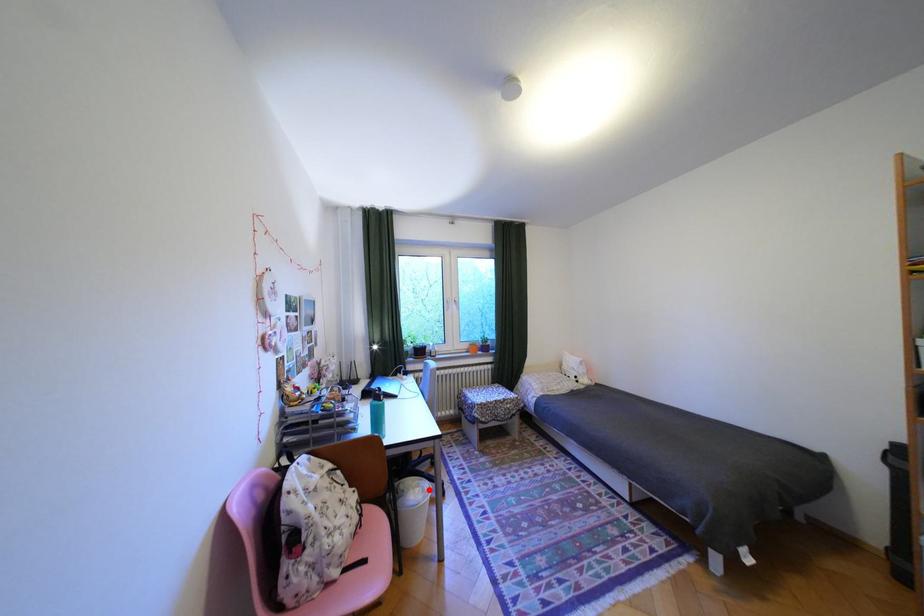
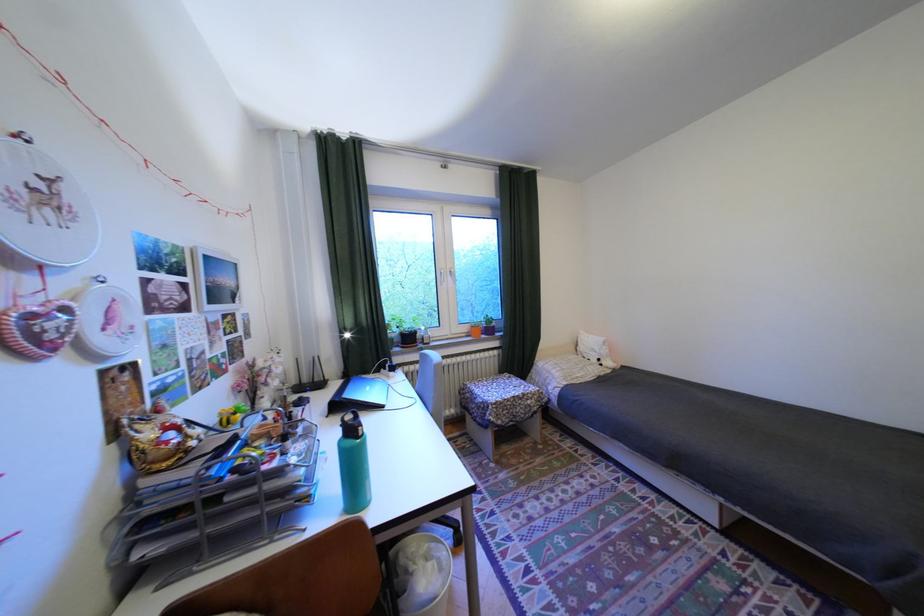
Find the pixel in the second image that matches the highlighted location in the first image.

(442, 565)